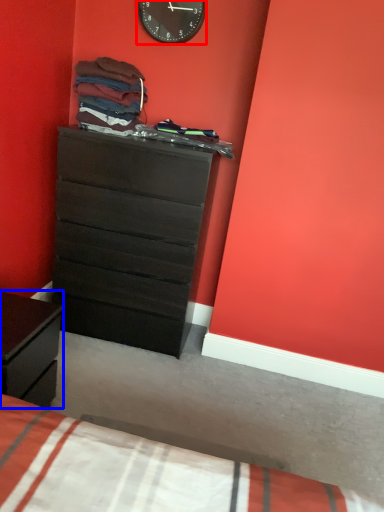
Question: Which object appears farthest to the camera in this image, wall clock (highlighted by a red box) or nightstand (highlighted by a blue box)?

Choices:
 (A) wall clock
 (B) nightstand

Answer: (A)